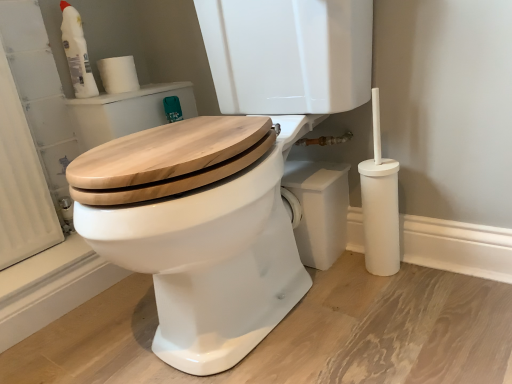
Question: Are white matte toilet paper at upper left and white plastic bottle at upper left located far from each other?

Choices:
 (A) yes
 (B) no

Answer: (B)

Question: Considering the relative sizes of white matte toilet paper at upper left and white plastic bottle at upper left in the image provided, is white matte toilet paper at upper left bigger than white plastic bottle at upper left?

Choices:
 (A) yes
 (B) no

Answer: (B)

Question: From the image's perspective, is white matte toilet paper at upper left below white plastic bottle at upper left?

Choices:
 (A) no
 (B) yes

Answer: (B)

Question: Is white matte toilet paper at upper left facing away from white plastic bottle at upper left?

Choices:
 (A) yes
 (B) no

Answer: (B)

Question: From the image's perspective, is white matte toilet paper at upper left on white plastic bottle at upper left?

Choices:
 (A) no
 (B) yes

Answer: (A)

Question: Is white matte toilet paper at upper left aimed at white plastic bottle at upper left?

Choices:
 (A) no
 (B) yes

Answer: (A)

Question: From the image's perspective, is wooden toilet seat at center on top of white matte toilet paper at upper left?

Choices:
 (A) yes
 (B) no

Answer: (B)

Question: Is wooden toilet seat at center outside of white matte toilet paper at upper left?

Choices:
 (A) no
 (B) yes

Answer: (B)

Question: Can you confirm if wooden toilet seat at center is positioned to the left of white matte toilet paper at upper left?

Choices:
 (A) yes
 (B) no

Answer: (B)

Question: Is wooden toilet seat at center wider than white matte toilet paper at upper left?

Choices:
 (A) yes
 (B) no

Answer: (A)

Question: From the image's perspective, is wooden toilet seat at center below white matte toilet paper at upper left?

Choices:
 (A) no
 (B) yes

Answer: (B)

Question: Is wooden toilet seat at center facing away from white matte toilet paper at upper left?

Choices:
 (A) yes
 (B) no

Answer: (B)

Question: From a real-world perspective, is white plastic bottle at upper left under white matte toilet paper at upper left?

Choices:
 (A) no
 (B) yes

Answer: (A)